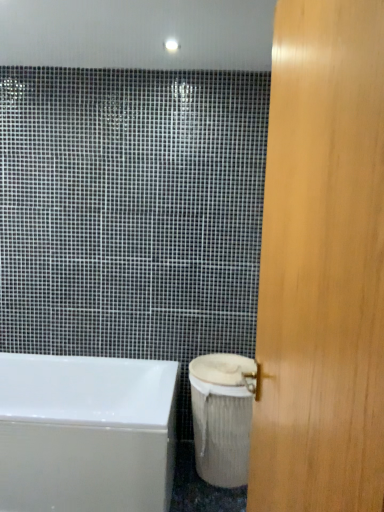
The height and width of the screenshot is (512, 384). I want to click on wooden door at right, so coord(322,265).

Is white textured toilet bowl at lower right bigger or smaller than wooden door at right?

Clearly, white textured toilet bowl at lower right is smaller in size than wooden door at right.

Does point (203, 396) come closer to viewer compared to point (376, 157)?

No, it is not.

Based on the photo, from the image's perspective, does white textured toilet bowl at lower right appear higher than wooden door at right?

Actually, white textured toilet bowl at lower right appears below wooden door at right in the image.

You are a GUI agent. You are given a task and a screenshot of the screen. Output one action in this format:
    pyautogui.click(x=<x>, y=<y>)
    Task: Click on the toilet bowl that appears below the wooden door at right (from the image's perspective)
    
    Given the screenshot: What is the action you would take?
    pyautogui.click(x=222, y=416)

From the image's perspective, is white textured toilet bowl at lower right located beneath white glossy bathtub at lower left?

Actually, white textured toilet bowl at lower right appears above white glossy bathtub at lower left in the image.

From a real-world perspective, which object stands above the other?

white textured toilet bowl at lower right, from a real-world perspective.

Is white textured toilet bowl at lower right next to white glossy bathtub at lower left and touching it?

No, white textured toilet bowl at lower right is not in contact with white glossy bathtub at lower left.

Is white glossy bathtub at lower left closer to the viewer compared to white textured toilet bowl at lower right?

Yes, white glossy bathtub at lower left is in front of white textured toilet bowl at lower right.

Consider the image. How many degrees apart are the facing directions of white glossy bathtub at lower left and white textured toilet bowl at lower right?

0.838 degrees separate the facing orientations of white glossy bathtub at lower left and white textured toilet bowl at lower right.

From the image's perspective, does white glossy bathtub at lower left appear lower than white textured toilet bowl at lower right?

Correct, white glossy bathtub at lower left appears lower than white textured toilet bowl at lower right in the image.

From a real-world perspective, is white glossy bathtub at lower left under white textured toilet bowl at lower right?

Indeed, from a real-world perspective, white glossy bathtub at lower left is positioned beneath white textured toilet bowl at lower right.

Between wooden door at right and white glossy bathtub at lower left, which one is positioned in front?

Positioned in front is wooden door at right.

Consider the image. Is wooden door at right facing towards white glossy bathtub at lower left?

No, wooden door at right is not facing towards white glossy bathtub at lower left.

How different are the orientations of wooden door at right and white glossy bathtub at lower left in degrees?

81.3 degrees.

Which is correct: wooden door at right is inside white glossy bathtub at lower left, or outside of it?

wooden door at right is located beyond the bounds of white glossy bathtub at lower left.

Is white glossy bathtub at lower left located outside wooden door at right?

Yes.

Which is more to the right, white glossy bathtub at lower left or wooden door at right?

wooden door at right is more to the right.

The height and width of the screenshot is (512, 384). What are the coordinates of `door above the white glossy bathtub at lower left (from a real-world perspective)` in the screenshot? It's located at (322, 265).

How many degrees apart are the facing directions of wooden door at right and white textured toilet bowl at lower right?

They differ by 82.2 degrees in their facing directions.

This screenshot has width=384, height=512. What are the coordinates of `toilet bowl that is below the wooden door at right (from the image's perspective)` in the screenshot? It's located at (222, 416).

Can white textured toilet bowl at lower right be found inside wooden door at right?

No, white textured toilet bowl at lower right is not inside wooden door at right.

Looking at this image, which of these two, wooden door at right or white textured toilet bowl at lower right, is wider?

white textured toilet bowl at lower right.

Locate an element on the screen. The image size is (384, 512). toilet bowl that is under the wooden door at right (from a real-world perspective) is located at coordinates (222, 416).

Image resolution: width=384 pixels, height=512 pixels. Identify the location of toilet bowl behind the white glossy bathtub at lower left. (222, 416).

When comparing their distances from white textured toilet bowl at lower right, does wooden door at right or white glossy bathtub at lower left seem closer?

white glossy bathtub at lower left.

Based on their spatial positions, is white glossy bathtub at lower left or wooden door at right closer to white textured toilet bowl at lower right?

white glossy bathtub at lower left is positioned closer to the anchor white textured toilet bowl at lower right.

Based on the photo, estimate the real-world distances between objects in this image. Which object is further from wooden door at right, white glossy bathtub at lower left or white textured toilet bowl at lower right?

Among the two, white glossy bathtub at lower left is located further to wooden door at right.

When comparing their distances from white glossy bathtub at lower left, does white textured toilet bowl at lower right or wooden door at right seem further?

The object further to white glossy bathtub at lower left is wooden door at right.

Estimate the real-world distances between objects in this image. Which object is further from wooden door at right, white textured toilet bowl at lower right or white glossy bathtub at lower left?

Based on the image, white glossy bathtub at lower left appears to be further to wooden door at right.

Based on their spatial positions, is wooden door at right or white textured toilet bowl at lower right further from white glossy bathtub at lower left?

wooden door at right.

You are a GUI agent. You are given a task and a screenshot of the screen. Output one action in this format:
    pyautogui.click(x=<x>, y=<y>)
    Task: Click on the bathtub positioned between wooden door at right and white textured toilet bowl at lower right from near to far
    This screenshot has height=512, width=384.
    Given the screenshot: What is the action you would take?
    pyautogui.click(x=86, y=433)